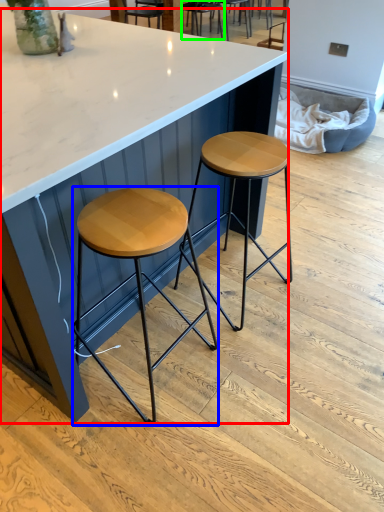
Question: Which is nearer to the table (highlighted by a red box)? stool (highlighted by a blue box) or chair (highlighted by a green box).

Choices:
 (A) stool
 (B) chair

Answer: (A)